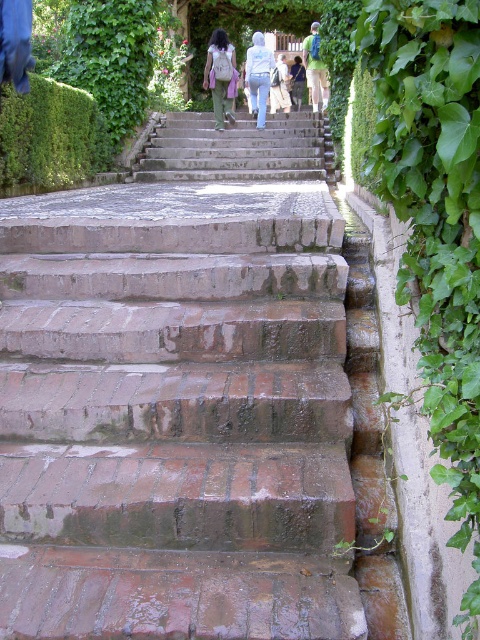
You are standing at the bottom of the brown brick stairs at center and want to place your light beige backpack at center on the ground next to the stairs. Is there enough space for the backpack?

The brown brick stairs at center occupies less space than light beige backpack at center, so there might not be enough space to place the backpack next to the stairs.